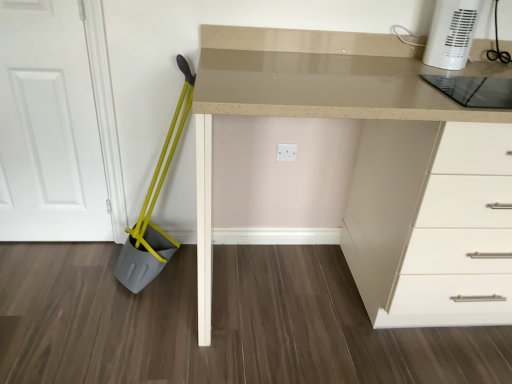
The height and width of the screenshot is (384, 512). I want to click on empty space that is in between matte beige desk at center and yellow plastic shovel at left, so [x=166, y=313].